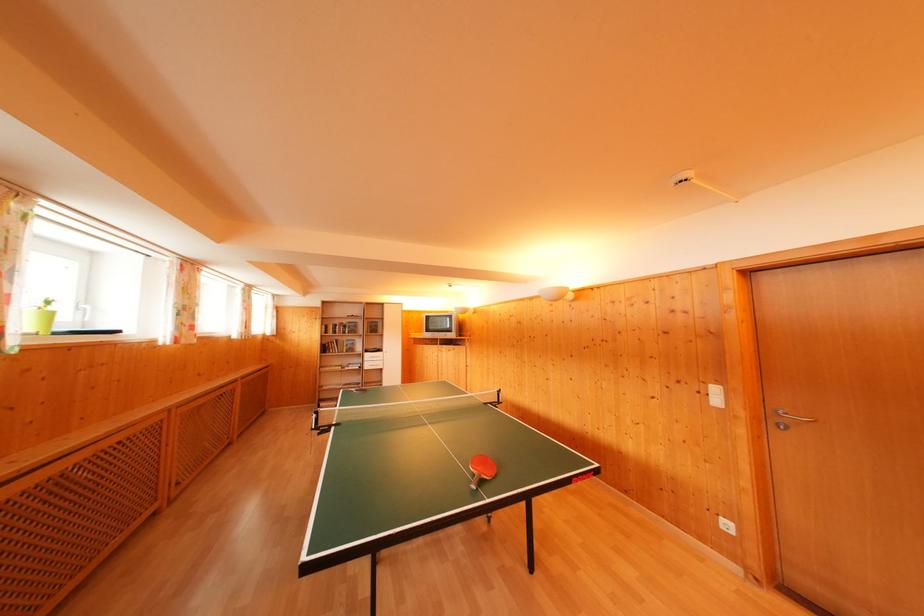
What do you see at coordinates (372, 359) in the screenshot? The height and width of the screenshot is (616, 924). I see `the white drawer front` at bounding box center [372, 359].